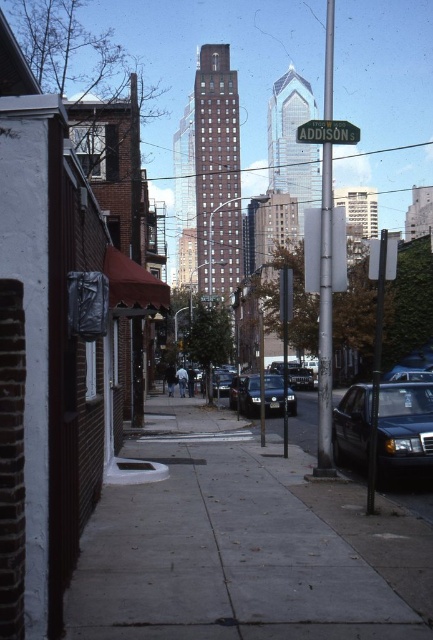
You are a pedestrian standing on the sidewalk and see the silver metallic pole at center and the green metallic street sign at center. Which object is closer to you?

The silver metallic pole at center is positioned over the green metallic street sign at center, so the pole is closer to you.

You are a delivery person trying to park your van on the gray concrete sidewalk at center. However, there is already a shiny black sedan at lower right parked there. Based on the scene, can you park your van next to the sedan without overlapping?

The gray concrete sidewalk at center is positioned on the left side of the shiny black sedan at lower right. Since the sidewalk is to the left of the sedan, there might be enough space to park the van next to the sedan on the sidewalk, but you need to ensure that the sidewalk extends beyond the sedan to accommodate the van without overlapping.

You are standing on the sidewalk and want to cross the street to reach the red brick building with a brown awning. The shiny black sedan at center is blocking your path. Can you walk around it safely if you need to stay on the sidewalk?

The shiny black sedan at center is 14.76 meters away from you. Since the sedan is parked on the sidewalk, you can walk around it safely by staying on the sidewalk as long as there is enough space between the sedan and the buildings or other obstacles. However, the exact feasibility depends on the width of the sidewalk and the presence of other parked vehicles or pedestrians, which are not specified in the provided information.